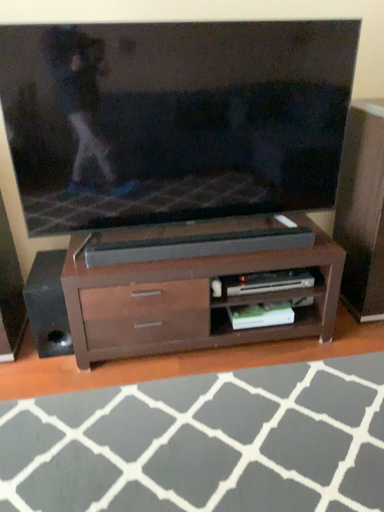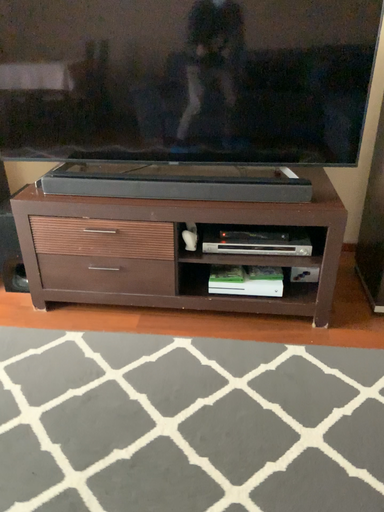
Question: Which way did the camera rotate in the video?

Choices:
 (A) rotated right
 (B) rotated left

Answer: (B)